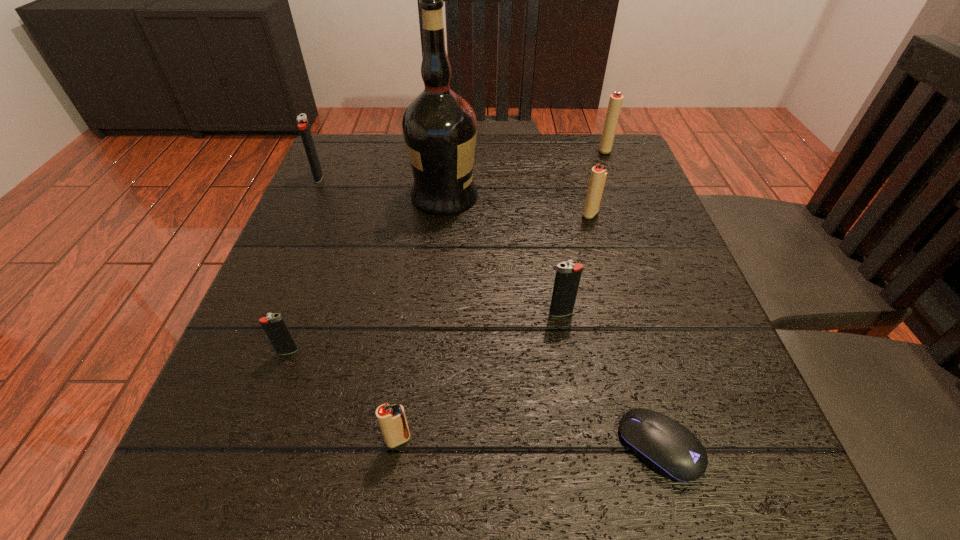
Locate an element on the screen. the tallest object is located at coordinates (440, 127).

The height and width of the screenshot is (540, 960). I want to click on the farthest object, so click(x=615, y=102).

At what (x,y) coordinates should I click in order to perform the action: click on the rightmost red igniter. Please return your answer as a coordinate pair (x, y). Looking at the image, I should click on (615, 102).

The width and height of the screenshot is (960, 540). I want to click on the leftmost igniter, so click(303, 126).

Image resolution: width=960 pixels, height=540 pixels. In order to click on the leftmost black igniter in this screenshot , I will do `click(303, 126)`.

This screenshot has height=540, width=960. I want to click on the third igniter from right to left, so [568, 275].

In order to click on the rightmost black igniter in this screenshot , I will do `click(568, 275)`.

The image size is (960, 540). What are the coordinates of `the second smallest red igniter` in the screenshot? It's located at (598, 175).

The height and width of the screenshot is (540, 960). Identify the location of the second farthest red igniter. (598, 175).

The image size is (960, 540). Identify the location of the leftmost red igniter. pyautogui.click(x=392, y=419).